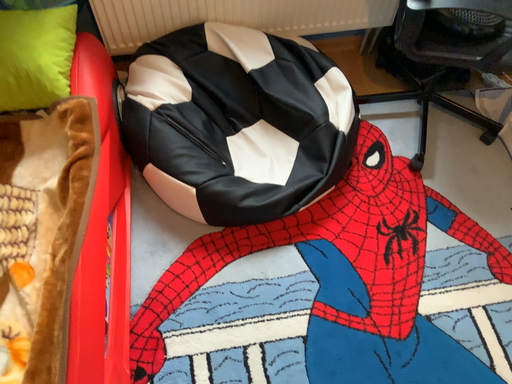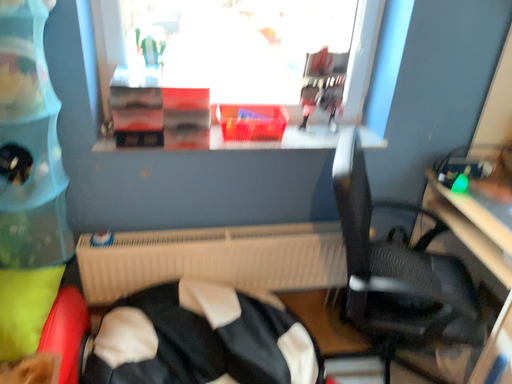
Question: Which way did the camera rotate in the video?

Choices:
 (A) rotated downward
 (B) rotated upward

Answer: (B)